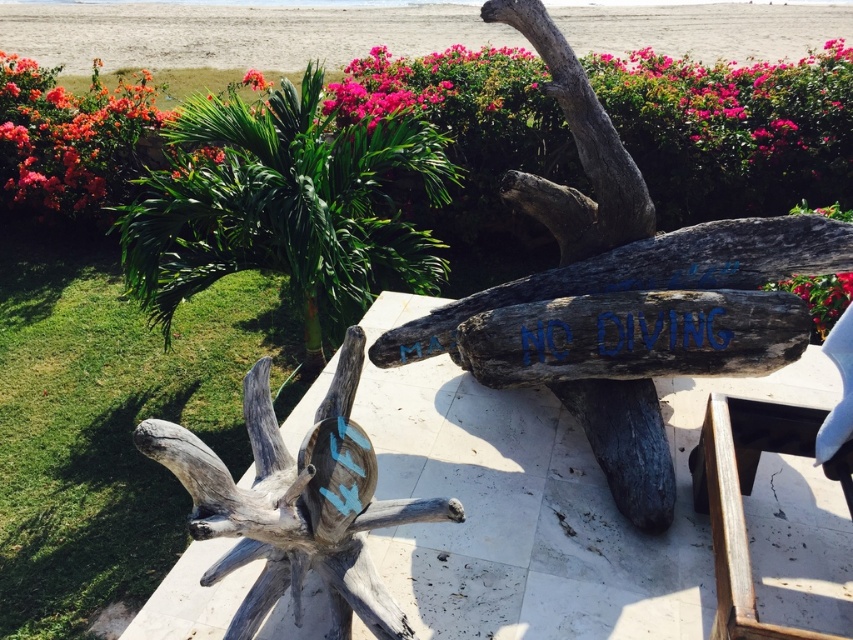
In the scene shown: Is dark brown wood at upper center to the right of vivid pink petals at upper right from the viewer's perspective?

Incorrect, dark brown wood at upper center is not on the right side of vivid pink petals at upper right.

Identify the location of dark brown wood at upper center. (577, 150).

Image resolution: width=853 pixels, height=640 pixels. I want to click on dark brown wood at upper center, so click(577, 150).

Does green leafy plant at upper left have a lesser width compared to vivid pink petals at upper center?

No.

Which is more to the left, green leafy plant at upper left or vivid pink petals at upper center?

vivid pink petals at upper center

Where is `green leafy plant at upper left`? The width and height of the screenshot is (853, 640). green leafy plant at upper left is located at coordinates (282, 205).

Does vibrant coral petals at upper left have a larger size compared to vivid pink petals at upper center?

Indeed, vibrant coral petals at upper left has a larger size compared to vivid pink petals at upper center.

Which is below, vibrant coral petals at upper left or vivid pink petals at upper center?

vibrant coral petals at upper left is lower down.

Who is more forward, (97, 218) or (267, 81)?

Point (97, 218) is in front.

Image resolution: width=853 pixels, height=640 pixels. I want to click on vibrant coral petals at upper left, so click(x=73, y=140).